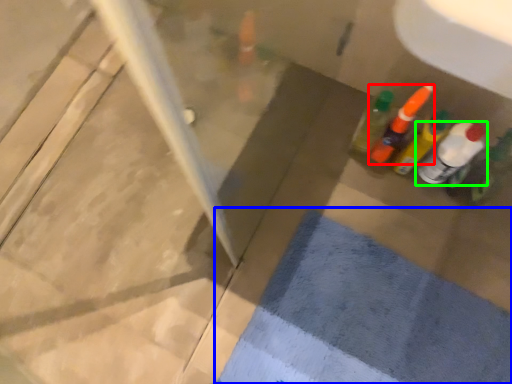
Question: Which object is the closest to the bottle (highlighted by a red box)? Choose among these: bath mat (highlighted by a blue box) or bottle (highlighted by a green box).

Choices:
 (A) bath mat
 (B) bottle

Answer: (B)